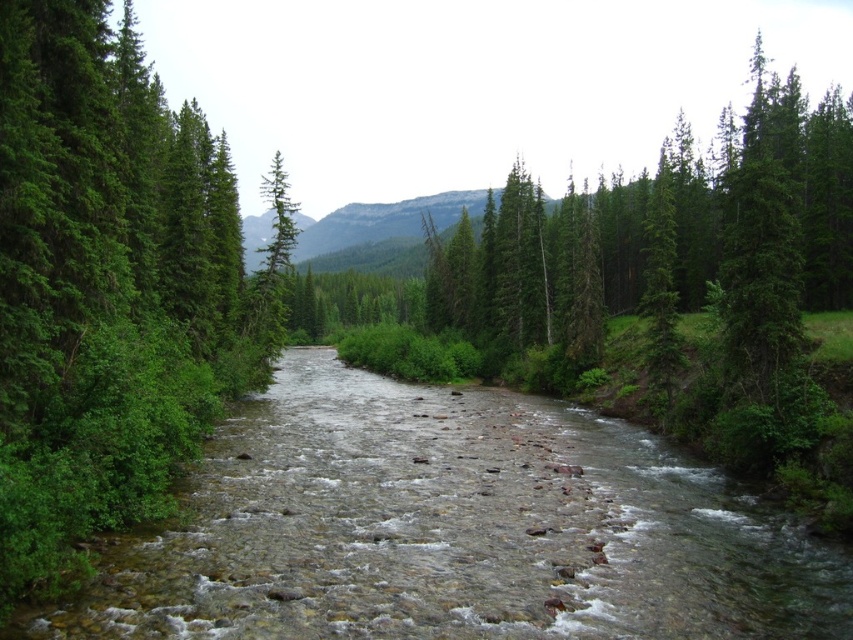
In the scene shown: You are standing at the edge of the clear stone stream at center and want to reach the green leafy tree at left. Which direction should you move to get closer to the tree?

To reach the green leafy tree at left from the clear stone stream at center, you should move towards the left since the stream is lower in height compared to the tree.

You are planning to cross the river using a small wooden bridge that can only support objects smaller than the green leafy tree at left. Can the clear stone stream at center be crossed safely using this bridge?

The clear stone stream at center has a smaller size compared to green leafy tree at left, so the bridge can support it. Therefore, the clear stone stream at center can be crossed safely using the bridge.